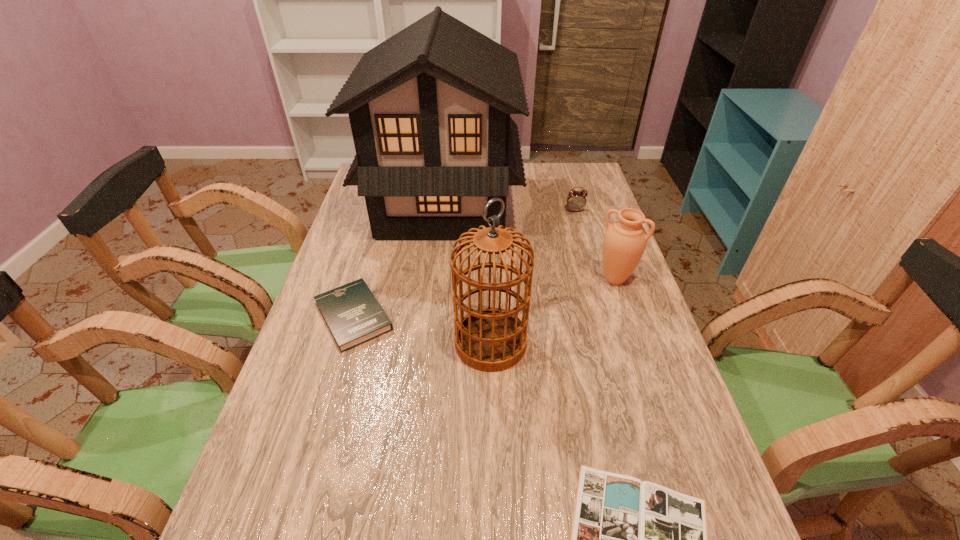
Where is `vacant space in between the taller book and the urn`? This screenshot has height=540, width=960. vacant space in between the taller book and the urn is located at coordinates (484, 298).

Identify the location of free space between the alarm clock and the dollhouse. (509, 207).

The height and width of the screenshot is (540, 960). Find the location of `free space between the fourth tallest object and the third tallest object`. free space between the fourth tallest object and the third tallest object is located at coordinates (595, 245).

Image resolution: width=960 pixels, height=540 pixels. I want to click on free space between the third tallest object and the birdcage, so click(x=553, y=311).

Choose which object is the fifth nearest neighbor to the urn. Please provide its 2D coordinates. Your answer should be formatted as a tuple, i.e. [(x, y)], where the tuple contains the x and y coordinates of a point satisfying the conditions above.

[(353, 315)]

Select which object appears as the second closest to the urn. Please provide its 2D coordinates. Your answer should be formatted as a tuple, i.e. [(x, y)], where the tuple contains the x and y coordinates of a point satisfying the conditions above.

[(489, 339)]

Image resolution: width=960 pixels, height=540 pixels. In order to click on free spot that satisfies the following two spatial constraints: 1. on the back side of the third tallest object; 2. on the right side of the fifth shortest object in this screenshot , I will do `click(489, 279)`.

Locate an element on the screen. Image resolution: width=960 pixels, height=540 pixels. vacant space that satisfies the following two spatial constraints: 1. on the front-facing side of the tallest object; 2. on the left side of the third tallest object is located at coordinates (434, 279).

Where is `vacant space that satisfies the following two spatial constraints: 1. on the front-facing side of the birdcage; 2. on the left side of the tallest object`? Image resolution: width=960 pixels, height=540 pixels. vacant space that satisfies the following two spatial constraints: 1. on the front-facing side of the birdcage; 2. on the left side of the tallest object is located at coordinates [x=426, y=343].

This screenshot has height=540, width=960. I want to click on free region that satisfies the following two spatial constraints: 1. on the back side of the urn; 2. on the left side of the second tallest object, so click(x=489, y=279).